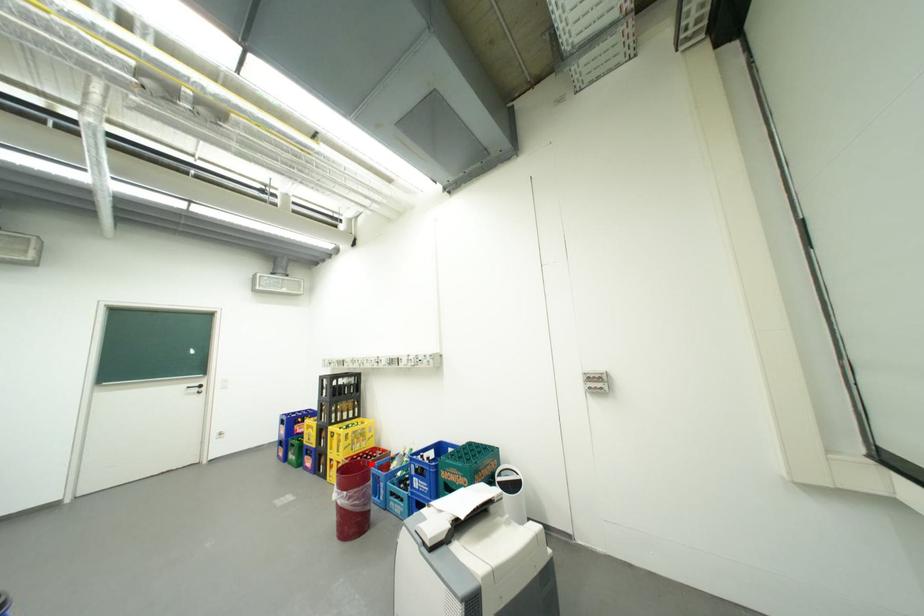
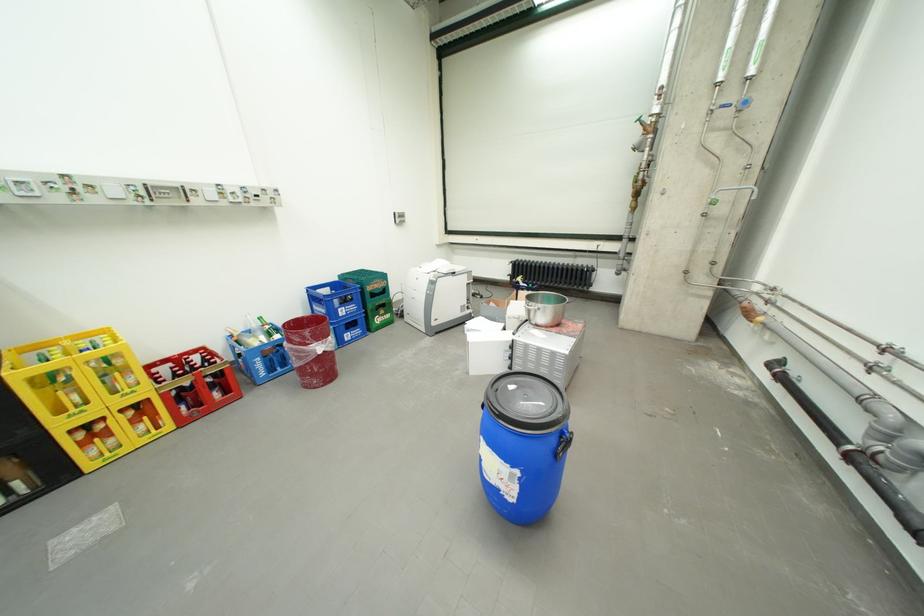
The point at the highlighted location is marked in the first image. Where is the corresponding point in the second image?

(297, 328)